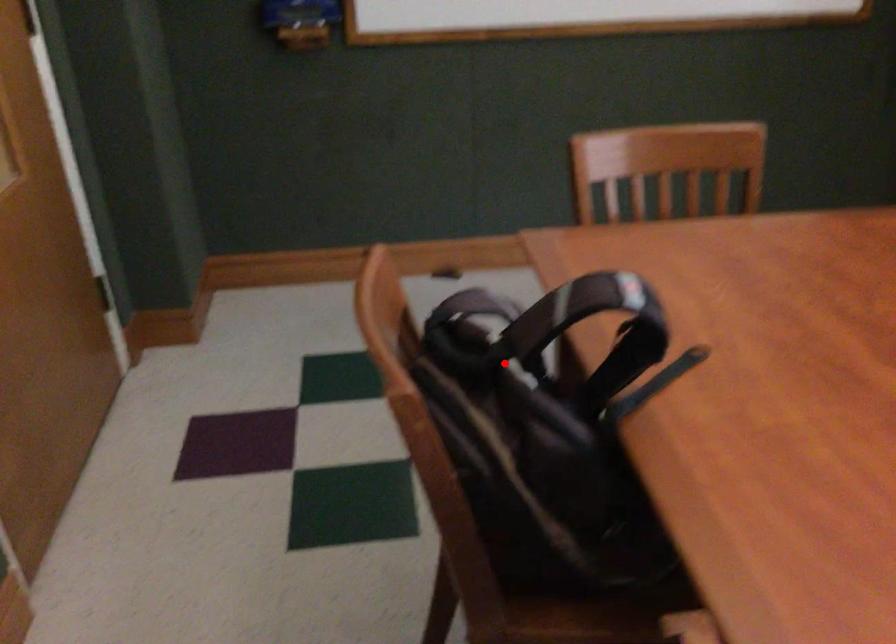
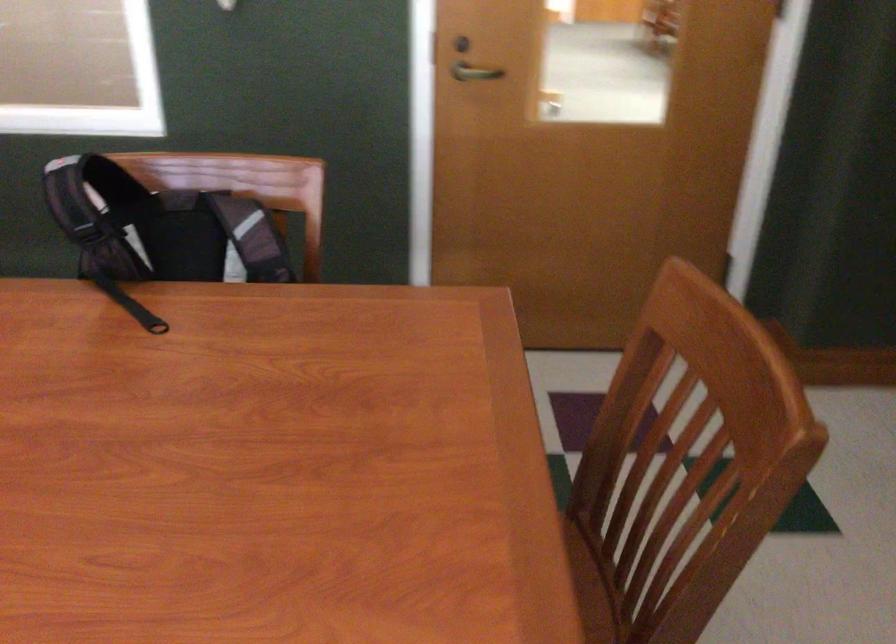
Question: I am providing you with two images of the same scene from different viewpoints. Image1 has a red point marked. In image2, the corresponding 3D location appears at what relative position? Reply with the corresponding letter.

Choices:
 (A) Closer
 (B) Farther

Answer: (B)